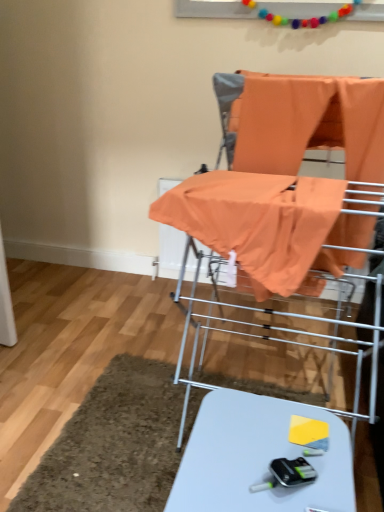
Question: From the image's perspective, is orange fabric baby carriage at center on orange fabric at center?

Choices:
 (A) yes
 (B) no

Answer: (B)

Question: Considering the relative sizes of orange fabric baby carriage at center and orange fabric at center in the image provided, is orange fabric baby carriage at center wider than orange fabric at center?

Choices:
 (A) no
 (B) yes

Answer: (B)

Question: Does orange fabric baby carriage at center appear on the right side of orange fabric at center?

Choices:
 (A) yes
 (B) no

Answer: (B)

Question: Is orange fabric baby carriage at center bigger than orange fabric at center?

Choices:
 (A) yes
 (B) no

Answer: (A)

Question: From the image's perspective, is orange fabric baby carriage at center under orange fabric at center?

Choices:
 (A) yes
 (B) no

Answer: (A)

Question: From a real-world perspective, is orange fabric baby carriage at center above or below orange fabric at center?

Choices:
 (A) below
 (B) above

Answer: (A)

Question: Is orange fabric baby carriage at center inside or outside of orange fabric at center?

Choices:
 (A) outside
 (B) inside

Answer: (A)

Question: Is orange fabric baby carriage at center taller or shorter than orange fabric at center?

Choices:
 (A) tall
 (B) short

Answer: (A)

Question: From the image's perspective, is orange fabric baby carriage at center above or below orange fabric at center?

Choices:
 (A) above
 (B) below

Answer: (B)

Question: Does point (221, 486) appear closer or farther from the camera than point (332, 83)?

Choices:
 (A) closer
 (B) farther

Answer: (A)

Question: Based on their positions, is white glossy table at lower center located to the left or right of orange fabric baby carriage at center?

Choices:
 (A) right
 (B) left

Answer: (B)

Question: From the image's perspective, relative to orange fabric baby carriage at center, is white glossy table at lower center above or below?

Choices:
 (A) above
 (B) below

Answer: (B)

Question: In terms of width, does white glossy table at lower center look wider or thinner when compared to orange fabric baby carriage at center?

Choices:
 (A) thin
 (B) wide

Answer: (A)

Question: Would you say orange fabric at center is inside or outside white glossy table at lower center?

Choices:
 (A) outside
 (B) inside

Answer: (A)

Question: Relative to white glossy table at lower center, is orange fabric at center in front or behind?

Choices:
 (A) behind
 (B) front

Answer: (A)